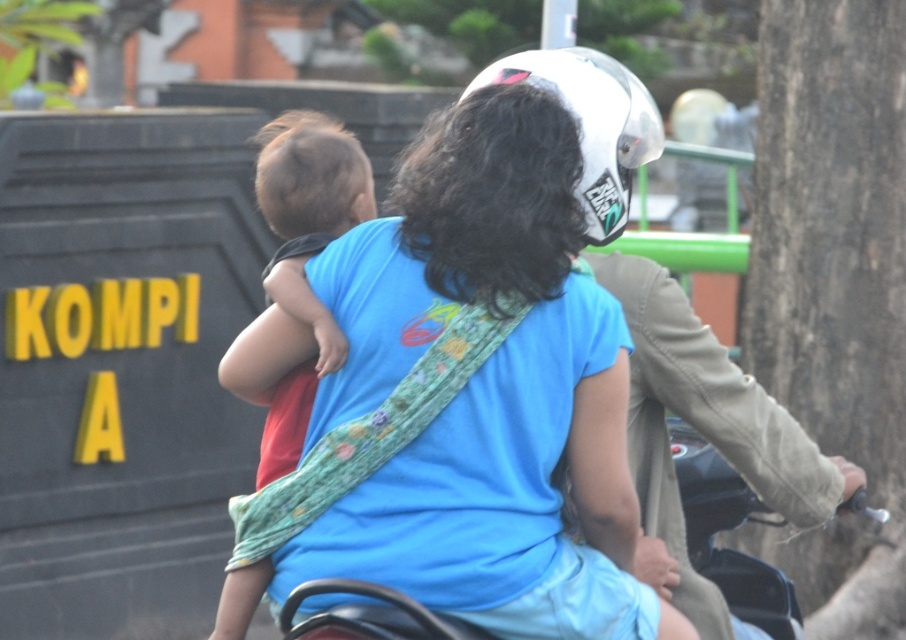
You are a photographer standing 5 meters away from the black matte motorcycle at center. You want to take a photo of it using a camera. Can you take a clear photo without moving?

The black matte motorcycle at center and camera are 5.02 meters apart, so yes, you can take a clear photo without moving since the distance is sufficient for a camera to capture it effectively.

You are a pedestrian standing at the side of the road. You see a blue fabric shirt at center and a smooth bark tree at right. Which object is closer to you?

The blue fabric shirt at center is closer to you because it is smaller than the smooth bark tree at right, indicating it is nearer in the scene.

Based on the scene description, which object is taller when comparing the blue fabric shirt at center and the light brown hair at upper left?

The blue fabric shirt at center is taller than the light brown hair at upper left according to the description.